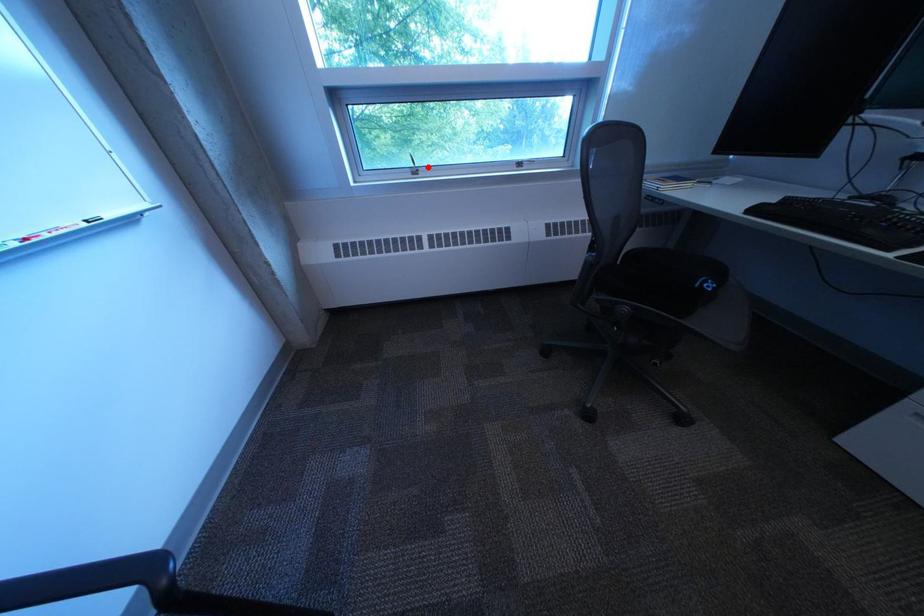
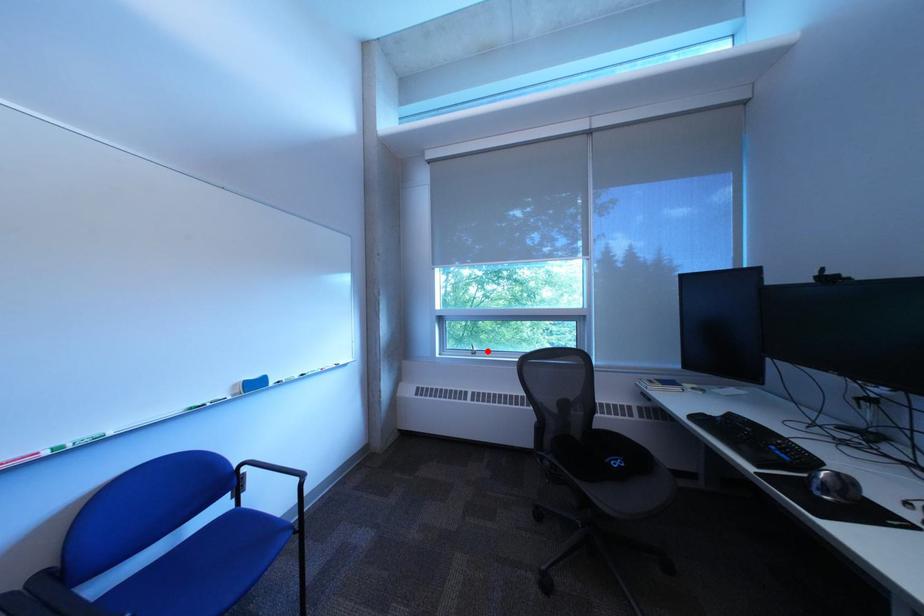
I am providing you with two images of the same scene from different viewpoints. A red point is marked on the first image and another point is marked on the second image. Is the red point in image1 aligned with the point shown in image2?

Yes